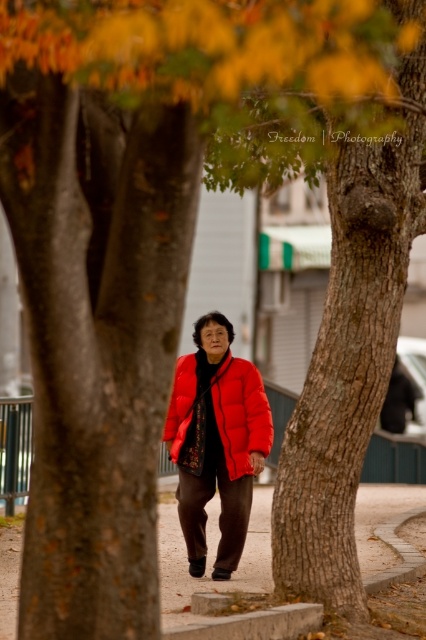
Question: Is matte red puffer jacket at center wider than concrete curb at lower center?

Choices:
 (A) no
 (B) yes

Answer: (A)

Question: Which point is closer to the camera taking this photo?

Choices:
 (A) (196, 636)
 (B) (385, 500)

Answer: (A)

Question: Is smooth concrete pavement at center behind concrete curb at lower center?

Choices:
 (A) no
 (B) yes

Answer: (A)

Question: Which point appears farthest from the camera in this image?

Choices:
 (A) (252, 561)
 (B) (241, 371)

Answer: (A)

Question: Which is farther from the concrete curb at lower center?

Choices:
 (A) matte red puffer jacket at center
 (B) smooth concrete pavement at center

Answer: (B)

Question: Can you confirm if smooth concrete pavement at center is wider than matte red puffer jacket at center?

Choices:
 (A) no
 (B) yes

Answer: (B)